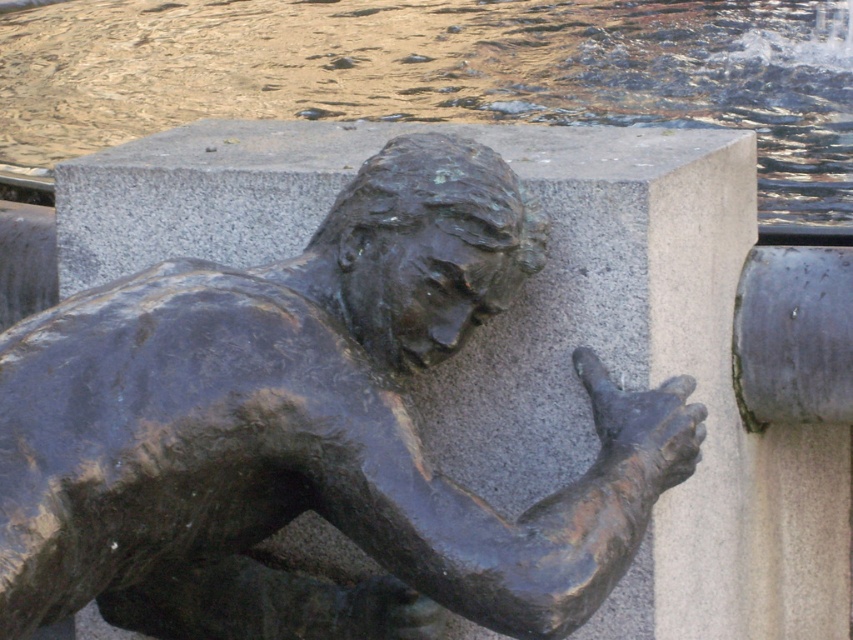
You are a maintenance worker tasked with cleaning the bronze statue at center and the glistening water at upper center. You have a 15 foot long hose. Can you reach both areas with the same hose without moving it?

The bronze statue at center and glistening water at upper center are 14.75 feet apart from each other. Since the hose is 15 feet long, you can reach both areas with the same hose without moving it because the distance between them is less than the hose length.

You are a tourist standing in front of the bronze statue at center and want to take a photo of the glistening water at upper center. Will the statue block your view of the water?

The bronze statue at center is in front of the glistening water at upper center, so it will block your view of the water.